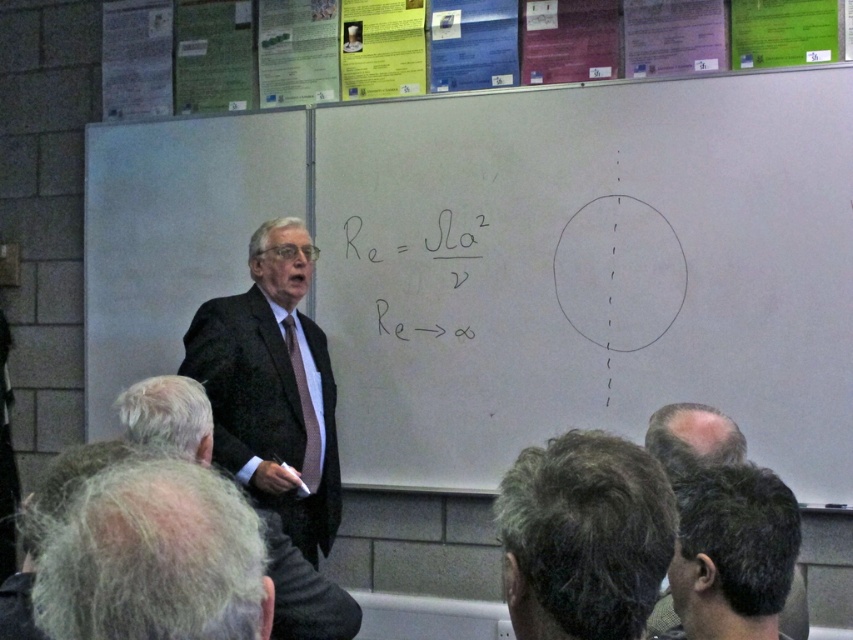
In the classroom scene, there is a whiteboard at center and a gray hair at lower left. Which object is positioned to the right of the other?

The whiteboard at center is to the right of gray hair at lower left.

You are a student sitting in the classroom and want to copy down the Reynolds number formula from the whiteboard at center. However, you notice that the gray hair at lower right is blocking your view. Can you determine which object is taller to see which one you should move past?

The whiteboard at center is taller than gray hair at lower right, so you should move past the gray hair at lower right to see the whiteboard at center.